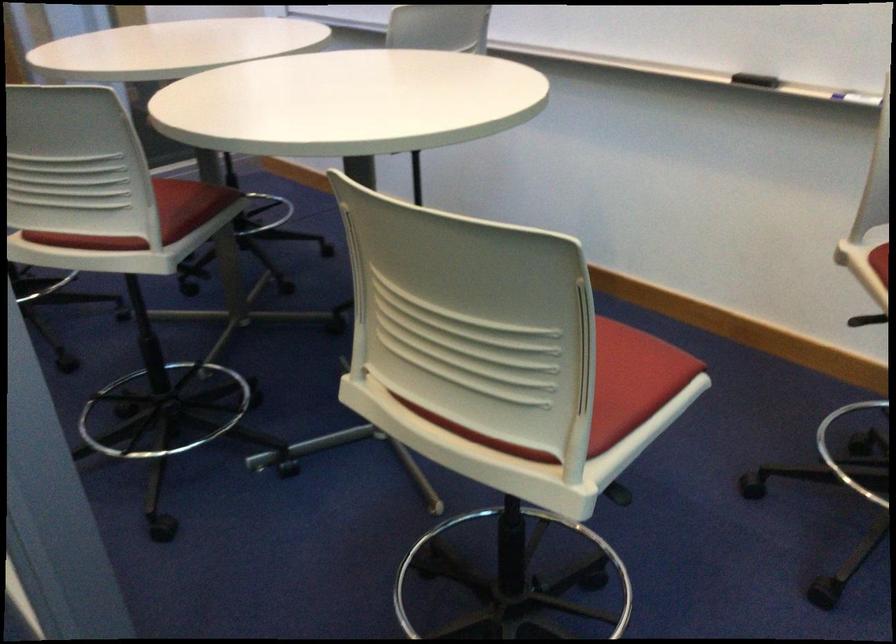
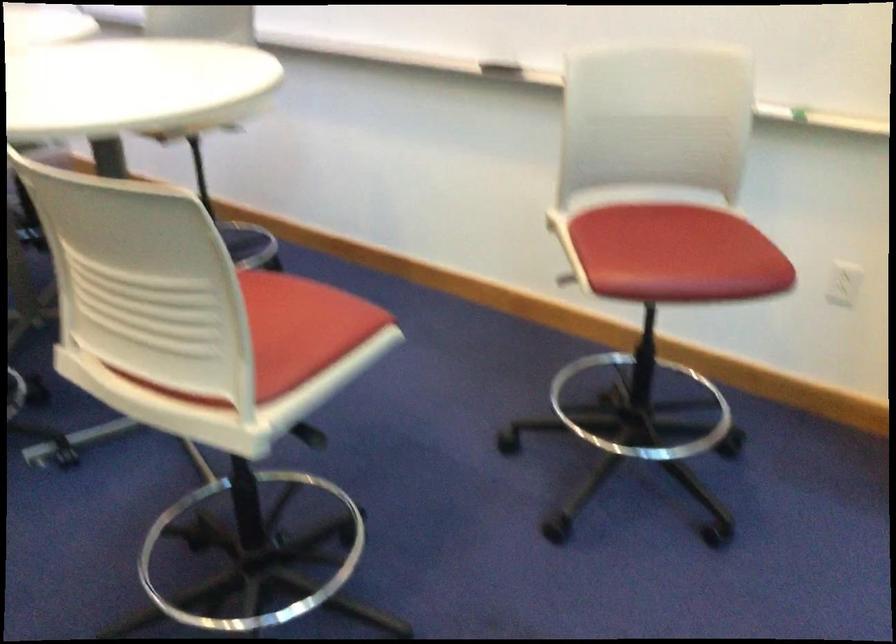
In a continuous first-person perspective shot, in which direction is the camera moving?

The cameraman moved toward right, backward.